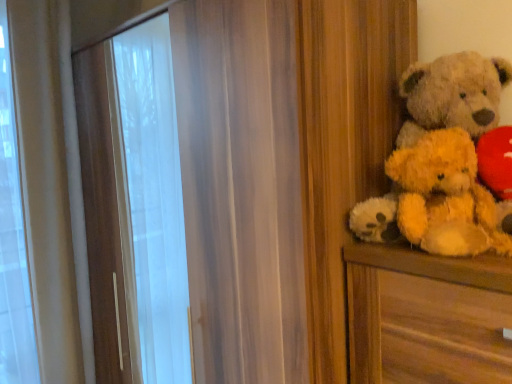
Question: Is fuzzy beige teddy bear at right positioned before yellow plush teddy bear at right?

Choices:
 (A) no
 (B) yes

Answer: (A)

Question: Can you confirm if fuzzy beige teddy bear at right is thinner than yellow plush teddy bear at right?

Choices:
 (A) no
 (B) yes

Answer: (A)

Question: Does fuzzy beige teddy bear at right contain yellow plush teddy bear at right?

Choices:
 (A) no
 (B) yes

Answer: (B)

Question: Is fuzzy beige teddy bear at right shorter than yellow plush teddy bear at right?

Choices:
 (A) no
 (B) yes

Answer: (A)

Question: Is fuzzy beige teddy bear at right to the right of yellow plush teddy bear at right from the viewer's perspective?

Choices:
 (A) yes
 (B) no

Answer: (A)

Question: Does fuzzy beige teddy bear at right have a smaller size compared to yellow plush teddy bear at right?

Choices:
 (A) no
 (B) yes

Answer: (A)

Question: Does yellow plush teddy bear at right have a lesser height compared to fuzzy beige teddy bear at right?

Choices:
 (A) no
 (B) yes

Answer: (B)

Question: Does yellow plush teddy bear at right have a smaller size compared to fuzzy beige teddy bear at right?

Choices:
 (A) no
 (B) yes

Answer: (B)

Question: Is yellow plush teddy bear at right bigger than fuzzy beige teddy bear at right?

Choices:
 (A) no
 (B) yes

Answer: (A)

Question: From the image's perspective, is yellow plush teddy bear at right located above fuzzy beige teddy bear at right?

Choices:
 (A) yes
 (B) no

Answer: (B)

Question: Is yellow plush teddy bear at right beside fuzzy beige teddy bear at right?

Choices:
 (A) no
 (B) yes

Answer: (B)

Question: From the image's perspective, is yellow plush teddy bear at right below fuzzy beige teddy bear at right?

Choices:
 (A) no
 (B) yes

Answer: (B)

Question: From the image's perspective, is yellow plush teddy bear at right positioned above or below fuzzy beige teddy bear at right?

Choices:
 (A) below
 (B) above

Answer: (A)